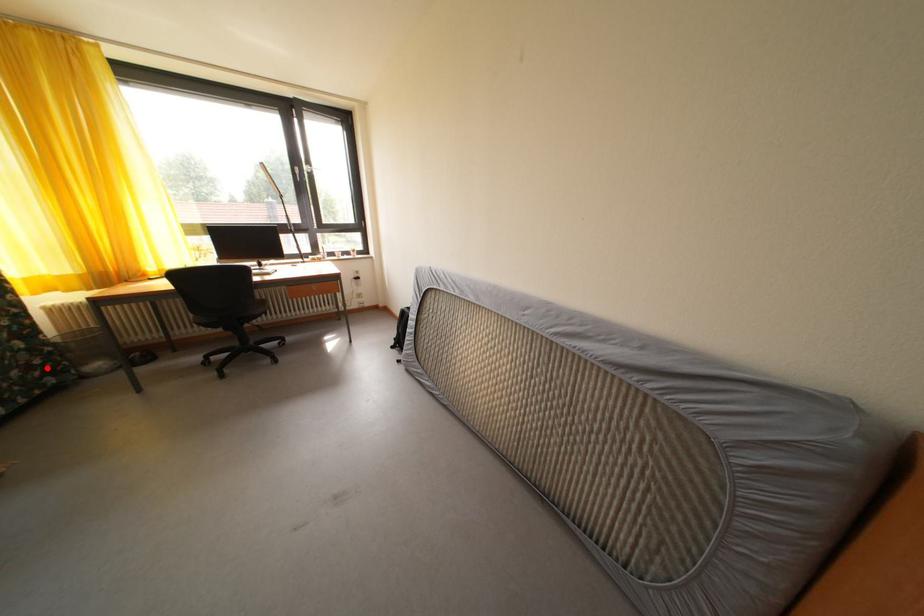
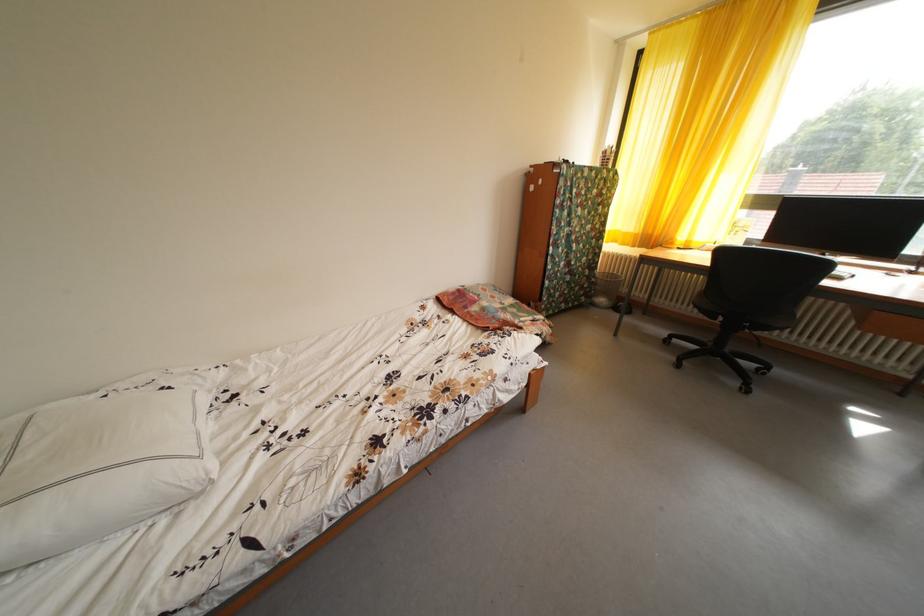
The point at the highlighted location is marked in the first image. Where is the corresponding point in the second image?

(594, 292)